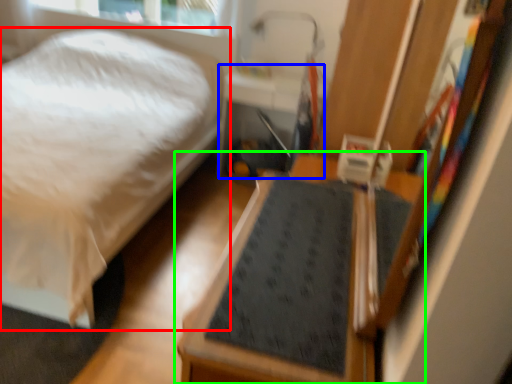
Question: Which object is positioned farthest from bed (highlighted by a red box)? Select from table (highlighted by a blue box) and furniture (highlighted by a green box).

Choices:
 (A) table
 (B) furniture

Answer: (B)